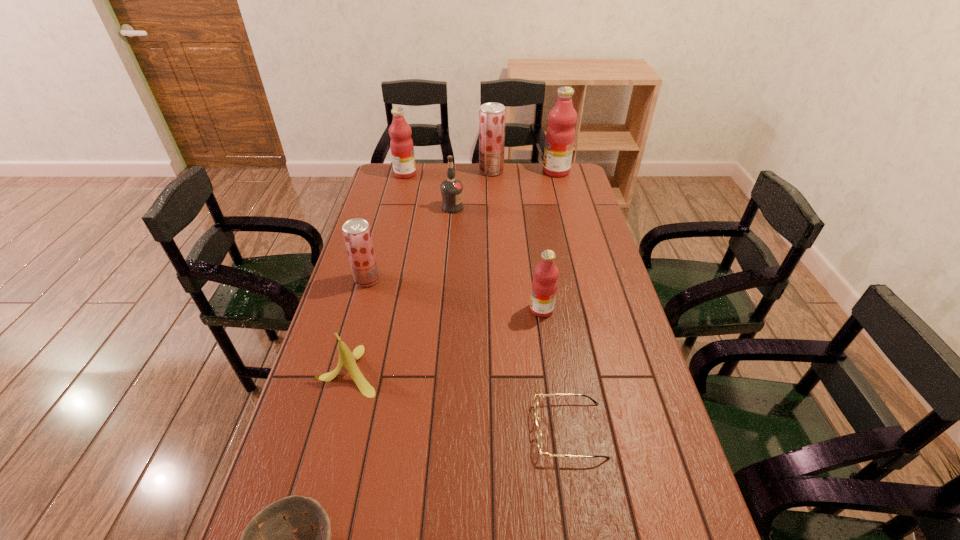
Identify the location of the smaller strawberry fruit juice. (357, 235).

Find the location of `banana`. banana is located at coordinates (348, 359).

Locate an element on the screen. the seventh farthest object is located at coordinates (348, 359).

Find the location of `green spectacles`. green spectacles is located at coordinates (539, 431).

Find the location of a particular element. The width and height of the screenshot is (960, 540). the shortest object is located at coordinates (539, 431).

You are a GUI agent. You are given a task and a screenshot of the screen. Output one action in this format:
    pyautogui.click(x=<x>, y=<y>)
    Task: Click on the blank area located on the label of the tallest object
    
    Given the screenshot: What is the action you would take?
    pyautogui.click(x=480, y=171)

Find the location of a particular element. The height and width of the screenshot is (540, 960). free space located on the label of the tallest object is located at coordinates (497, 171).

Where is `vacant space located on the label of the tallest object`? The height and width of the screenshot is (540, 960). vacant space located on the label of the tallest object is located at coordinates (532, 171).

This screenshot has height=540, width=960. What are the coordinates of `vacant space situated 0.080m on the left of the fourth object from right to left` in the screenshot? It's located at (462, 171).

Identify the location of free region located on the label of the leftmost pink fruit juice. (456, 174).